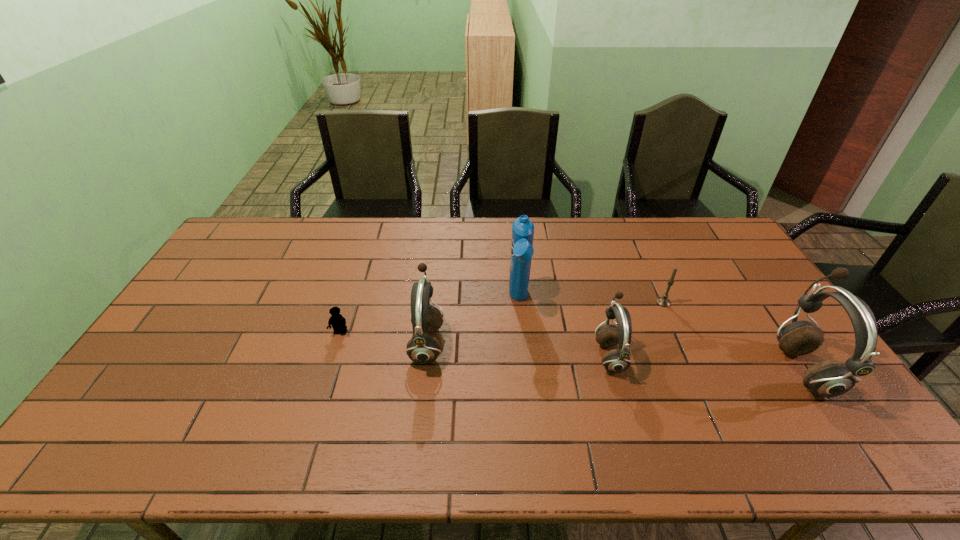
Please point a free position for a earphone on the left. Please provide its 2D coordinates. Your answer should be formatted as a tuple, i.e. [(x, y)], where the tuple contains the x and y coordinates of a point satisfying the conditions above.

[(253, 331)]